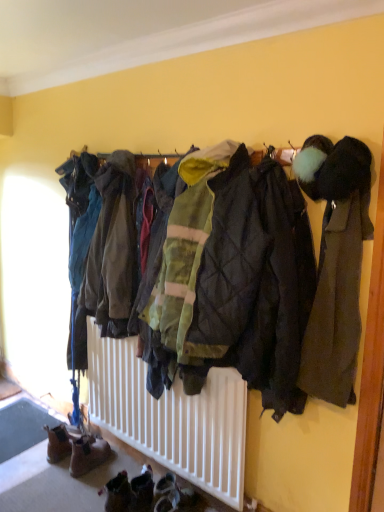
Question: Which direction should I rotate to look at green quilted jacket at center, which ranks as the 1th jacket in left-to-right order, — up or down?

Choices:
 (A) down
 (B) up

Answer: (B)

Question: Can you confirm if green quilted jacket at center, the first jacket positioned from the back, is thinner than brown suede boots at lower left?

Choices:
 (A) yes
 (B) no

Answer: (B)

Question: From a real-world perspective, is green quilted jacket at center, the first jacket positioned from the back, physically below brown suede boots at lower left?

Choices:
 (A) yes
 (B) no

Answer: (B)

Question: Is green quilted jacket at center, which ranks as the 1th jacket in left-to-right order, smaller than brown suede boots at lower left?

Choices:
 (A) no
 (B) yes

Answer: (A)

Question: From the image's perspective, is green quilted jacket at center, which ranks as the second jacket in front-to-back order, above brown suede boots at lower left?

Choices:
 (A) yes
 (B) no

Answer: (A)

Question: From the image's perspective, is green quilted jacket at center, the first jacket positioned from the back, located beneath brown suede boots at lower left?

Choices:
 (A) yes
 (B) no

Answer: (B)

Question: Is green quilted jacket at center, the first jacket positioned from the back, to the right of brown suede boots at lower left from the viewer's perspective?

Choices:
 (A) no
 (B) yes

Answer: (B)

Question: From a real-world perspective, is green quilted jacket at center, which ranks as the second jacket in front-to-back order, below dark gray wool coat at right, which is counted as the 1th jacket, starting from the front?

Choices:
 (A) no
 (B) yes

Answer: (A)

Question: Can you confirm if green quilted jacket at center, the first jacket positioned from the back, is shorter than dark gray wool coat at right, which is the 2th jacket from back to front?

Choices:
 (A) yes
 (B) no

Answer: (B)

Question: Can you confirm if green quilted jacket at center, which ranks as the 1th jacket in left-to-right order, is bigger than dark gray wool coat at right, which is the 2th jacket from back to front?

Choices:
 (A) yes
 (B) no

Answer: (A)

Question: Does green quilted jacket at center, which ranks as the 1th jacket in left-to-right order, appear on the left side of dark gray wool coat at right, the 1th jacket from the right?

Choices:
 (A) yes
 (B) no

Answer: (A)

Question: Is green quilted jacket at center, the second jacket viewed from the right, not within dark gray wool coat at right, which is the 2th jacket from left to right?

Choices:
 (A) no
 (B) yes

Answer: (B)

Question: Does green quilted jacket at center, the first jacket positioned from the back, have a lesser width compared to dark gray wool coat at right, the 1th jacket from the right?

Choices:
 (A) yes
 (B) no

Answer: (B)

Question: Is brown suede boots at lower left not inside green quilted jacket at center, which ranks as the second jacket in front-to-back order?

Choices:
 (A) no
 (B) yes

Answer: (B)